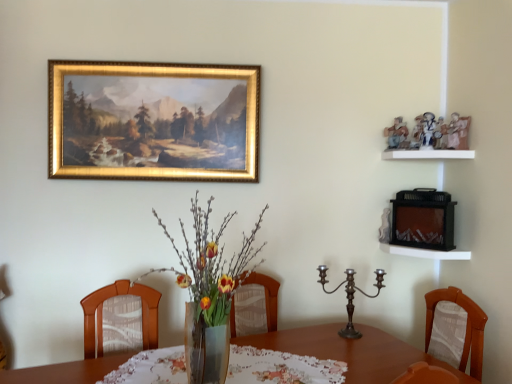
At what (x,y) coordinates should I click in order to perform the action: click on free space above printed fabric tablecloth at center (from a real-world perspective). Please return your answer as a coordinate pair (x, y). The image size is (512, 384). Looking at the image, I should click on (233, 367).